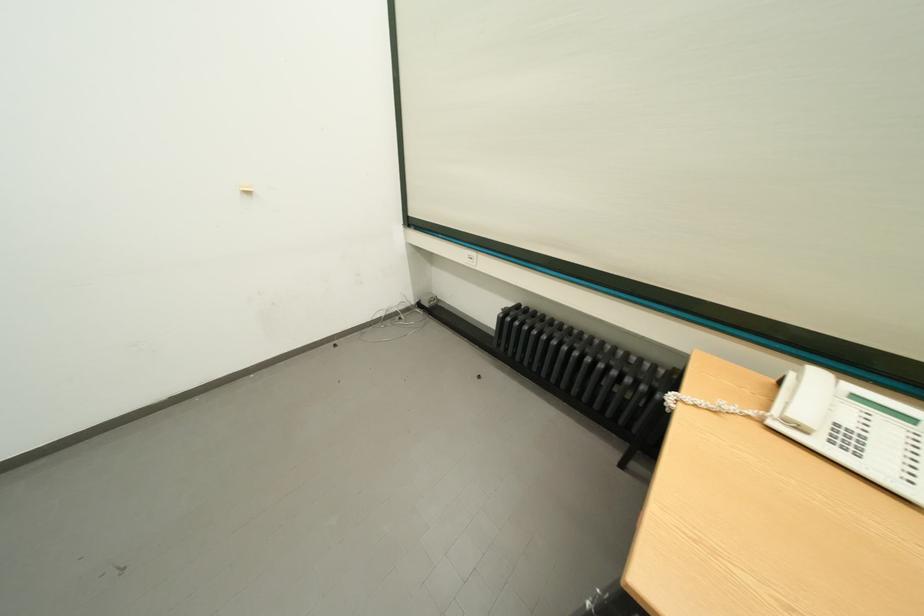
Locate an element on the screen. The height and width of the screenshot is (616, 924). telephone handset is located at coordinates (808, 399).